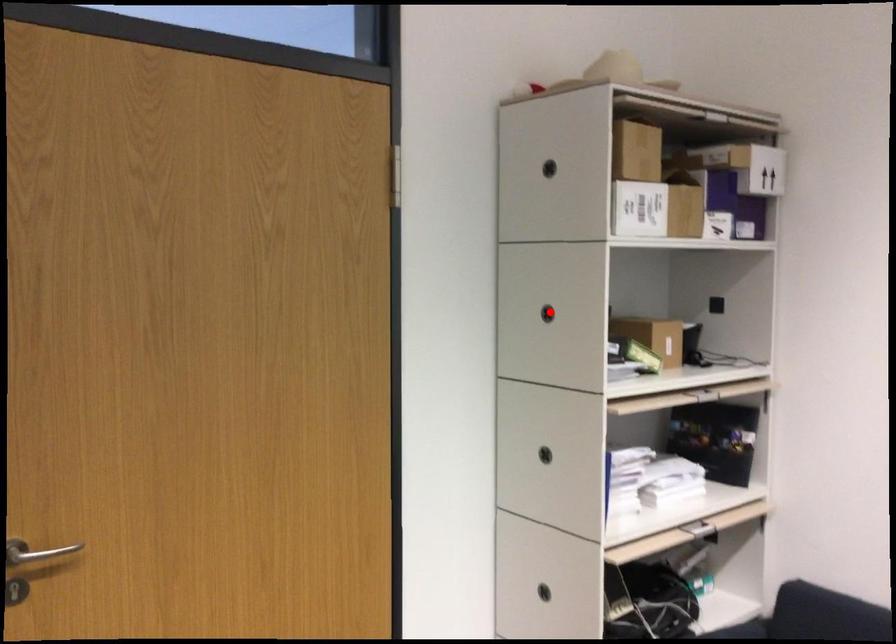
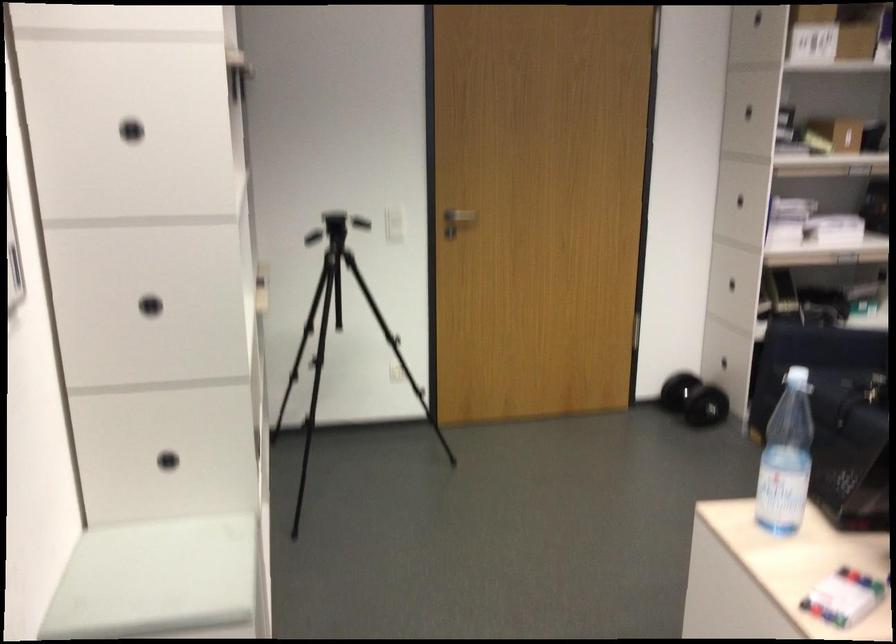
Question: I am providing you with two images of the same scene from different viewpoints. In image1, a red point is highlighted. Considering the same 3D point in image2, which of the following is correct?

Choices:
 (A) It is closer
 (B) It is farther

Answer: (B)